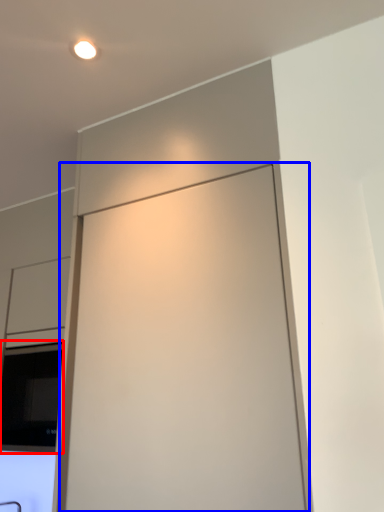
Question: Which object appears closest to the camera in this image, window (highlighted by a red box) or screen door (highlighted by a blue box)?

Choices:
 (A) window
 (B) screen door

Answer: (B)